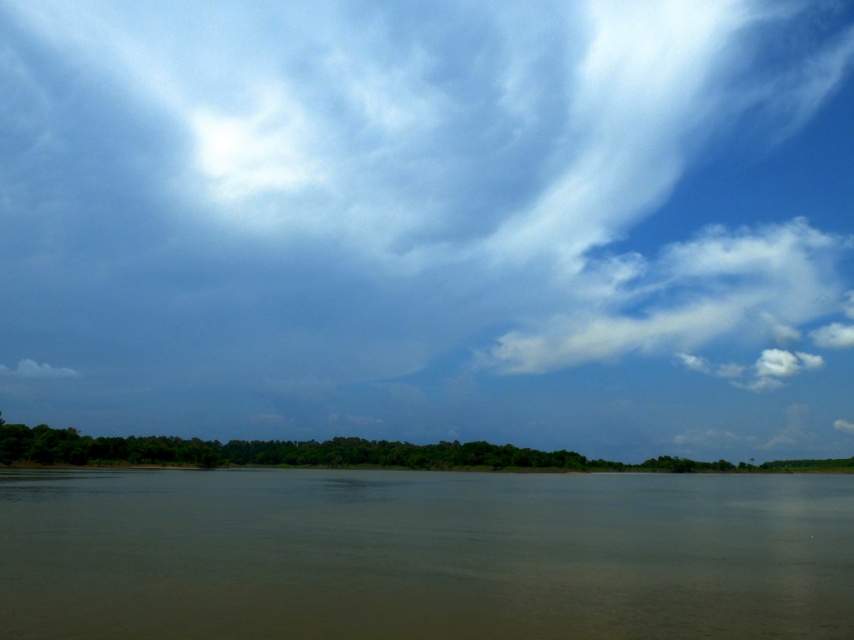
You are an artist painting the scene. You want to ensure the blue sky at upper center and the white fluffy cloud at upper right are proportionally accurate. Which object should you make larger in your painting?

The blue sky at upper center should be made larger in the painting since it has a larger size compared to the white fluffy cloud at upper right according to the description.

Looking at this image, you are a photographer trying to capture the reflection of the white fluffy cloud at lower left in the brown muddy water at center. Based on the scene, will you be able to see the reflection of the cloud in the water?

The brown muddy water at center is in front of the white fluffy cloud at lower left, so the reflection of the cloud would not be visible in the water since the cloud is behind the water from the observer perspective.